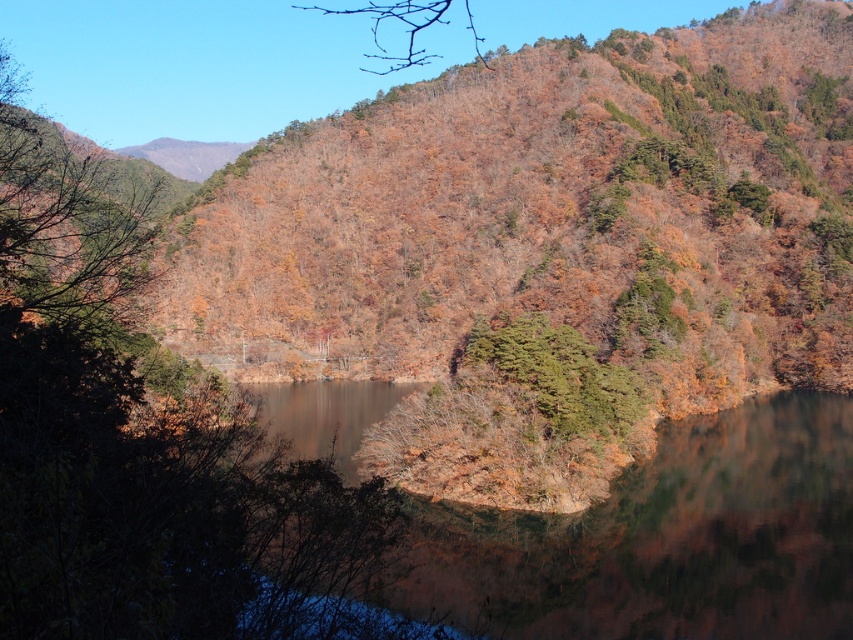
Question: Which object is farther from the camera taking this photo?

Choices:
 (A) green matte tree at center
 (B) bare branches at upper center
 (C) transparent water at center

Answer: (B)

Question: Can you confirm if transparent water at center is wider than bare branches at upper center?

Choices:
 (A) no
 (B) yes

Answer: (A)

Question: Can you confirm if transparent water at center is positioned below bare branches at upper center?

Choices:
 (A) no
 (B) yes

Answer: (B)

Question: Does transparent water at center appear on the left side of bare branches at upper center?

Choices:
 (A) yes
 (B) no

Answer: (B)

Question: Which point appears closest to the camera in this image?

Choices:
 (A) (605, 417)
 (B) (556, 524)

Answer: (B)

Question: Estimate the real-world distances between objects in this image. Which object is farther from the transparent water at center?

Choices:
 (A) bare branches at upper center
 (B) green matte tree at center

Answer: (A)